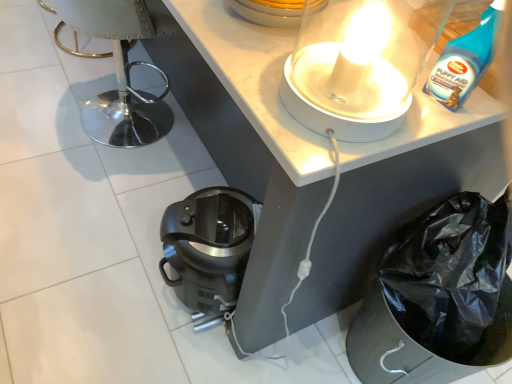
Question: Does matte black coffee maker at lower center have a larger size compared to blue plastic bottle at upper right?

Choices:
 (A) yes
 (B) no

Answer: (A)

Question: Does matte black coffee maker at lower center have a lesser height compared to blue plastic bottle at upper right?

Choices:
 (A) no
 (B) yes

Answer: (B)

Question: Is the position of matte black coffee maker at lower center more distant than that of blue plastic bottle at upper right?

Choices:
 (A) no
 (B) yes

Answer: (B)

Question: Is matte black coffee maker at lower center smaller than blue plastic bottle at upper right?

Choices:
 (A) yes
 (B) no

Answer: (B)

Question: Is matte black coffee maker at lower center wider than blue plastic bottle at upper right?

Choices:
 (A) yes
 (B) no

Answer: (A)

Question: Considering the positions of metallic silver swivel chair at left and matte black coffee maker at lower center in the image, is metallic silver swivel chair at left taller or shorter than matte black coffee maker at lower center?

Choices:
 (A) short
 (B) tall

Answer: (B)

Question: From a real-world perspective, is metallic silver swivel chair at left positioned above or below matte black coffee maker at lower center?

Choices:
 (A) above
 (B) below

Answer: (A)

Question: Is point (87, 120) positioned closer to the camera than point (203, 142)?

Choices:
 (A) closer
 (B) farther

Answer: (A)

Question: In terms of width, does metallic silver swivel chair at left look wider or thinner when compared to matte black coffee maker at lower center?

Choices:
 (A) thin
 (B) wide

Answer: (A)

Question: Based on their sizes in the image, would you say black plastic coffee maker at lower center is bigger or smaller than blue plastic bottle at upper right?

Choices:
 (A) small
 (B) big

Answer: (B)

Question: Is black plastic coffee maker at lower center in front of or behind blue plastic bottle at upper right in the image?

Choices:
 (A) front
 (B) behind

Answer: (B)

Question: In the image, is black plastic coffee maker at lower center on the left side or the right side of blue plastic bottle at upper right?

Choices:
 (A) left
 (B) right

Answer: (A)

Question: Is black plastic coffee maker at lower center inside or outside of blue plastic bottle at upper right?

Choices:
 (A) outside
 (B) inside

Answer: (A)

Question: Based on their positions, is matte black coffee maker at lower center located to the left or right of white glossy lamp at upper center?

Choices:
 (A) right
 (B) left

Answer: (B)

Question: From a real-world perspective, is matte black coffee maker at lower center positioned above or below white glossy lamp at upper center?

Choices:
 (A) below
 (B) above

Answer: (A)